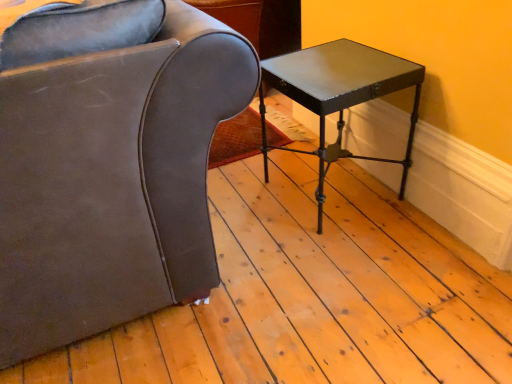
Find the location of a particular element. The image size is (512, 384). free space in front of glossy black table at right is located at coordinates (355, 253).